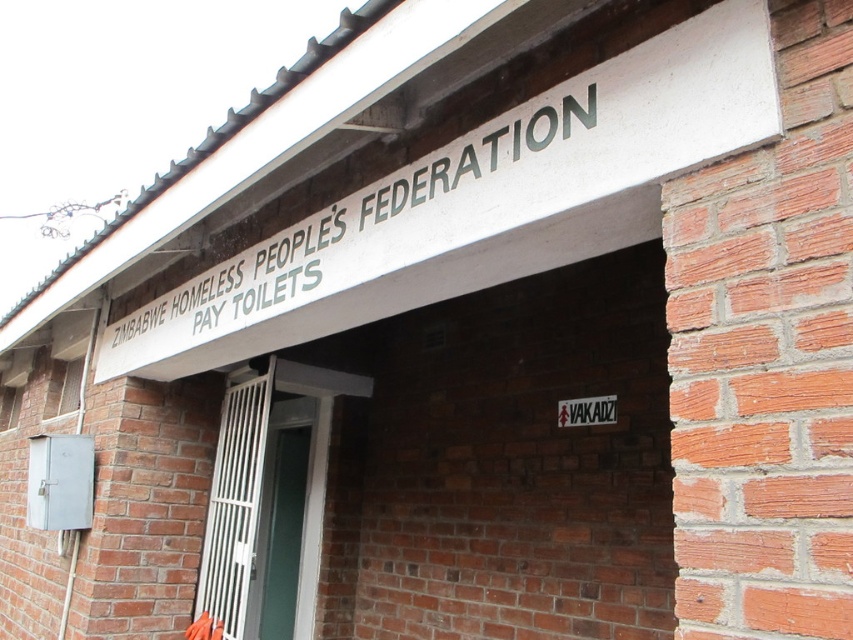
Question: Can you confirm if white metallic sign at upper center is positioned to the right of white metal gate at center?

Choices:
 (A) no
 (B) yes

Answer: (B)

Question: Does white metallic sign at upper center lie in front of white metal gate at center?

Choices:
 (A) no
 (B) yes

Answer: (B)

Question: Which of the following is the farthest from the observer?

Choices:
 (A) (204, 545)
 (B) (293, 244)

Answer: (A)

Question: Is white metallic sign at upper center behind white metal gate at center?

Choices:
 (A) yes
 (B) no

Answer: (B)

Question: Which of the following is the farthest from the observer?

Choices:
 (A) white metal gate at center
 (B) white metallic sign at upper center

Answer: (A)